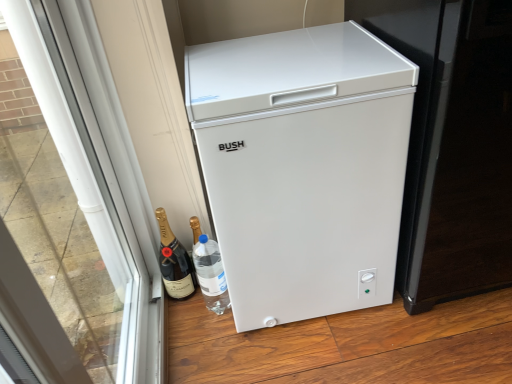
Question: Does white matte refrigerator at center have a greater width compared to transparent glass door at left?

Choices:
 (A) yes
 (B) no

Answer: (A)

Question: Can you confirm if white matte refrigerator at center is taller than transparent glass door at left?

Choices:
 (A) yes
 (B) no

Answer: (B)

Question: Does white matte refrigerator at center turn towards transparent glass door at left?

Choices:
 (A) yes
 (B) no

Answer: (B)

Question: Is white matte refrigerator at center thinner than transparent glass door at left?

Choices:
 (A) yes
 (B) no

Answer: (B)

Question: Is white matte refrigerator at center positioned far away from transparent glass door at left?

Choices:
 (A) no
 (B) yes

Answer: (A)

Question: From a real-world perspective, is white matte refrigerator at center under transparent glass door at left?

Choices:
 (A) no
 (B) yes

Answer: (B)

Question: Is black glass bottle at lower left not inside white plastic freezer at right?

Choices:
 (A) yes
 (B) no

Answer: (A)

Question: Can you see black glass bottle at lower left touching white plastic freezer at right?

Choices:
 (A) yes
 (B) no

Answer: (B)

Question: Is white plastic freezer at right surrounded by black glass bottle at lower left?

Choices:
 (A) yes
 (B) no

Answer: (B)

Question: Would you consider black glass bottle at lower left to be distant from white plastic freezer at right?

Choices:
 (A) no
 (B) yes

Answer: (A)

Question: Considering the relative sizes of black glass bottle at lower left and white plastic freezer at right in the image provided, is black glass bottle at lower left smaller than white plastic freezer at right?

Choices:
 (A) yes
 (B) no

Answer: (A)

Question: Is black glass bottle at lower left aimed at white plastic freezer at right?

Choices:
 (A) no
 (B) yes

Answer: (A)

Question: Is black glass bottle at lower left thinner than white matte refrigerator at center?

Choices:
 (A) yes
 (B) no

Answer: (A)